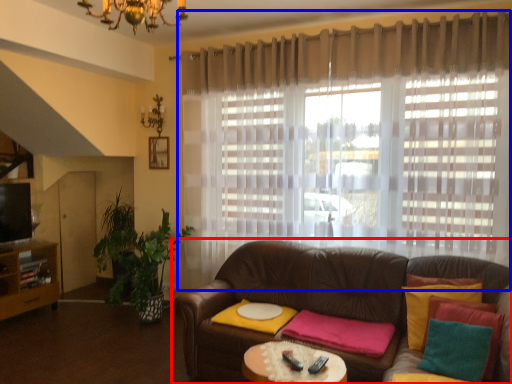
Question: Among these objects, which one is nearest to the camera, studio couch (highlighted by a red box) or curtain (highlighted by a blue box)?

Choices:
 (A) studio couch
 (B) curtain

Answer: (A)